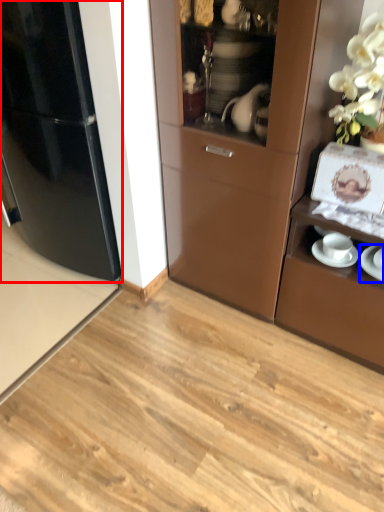
Question: Which object is further to the camera taking this photo, refrigerator (highlighted by a red box) or saucer (highlighted by a blue box)?

Choices:
 (A) refrigerator
 (B) saucer

Answer: (A)